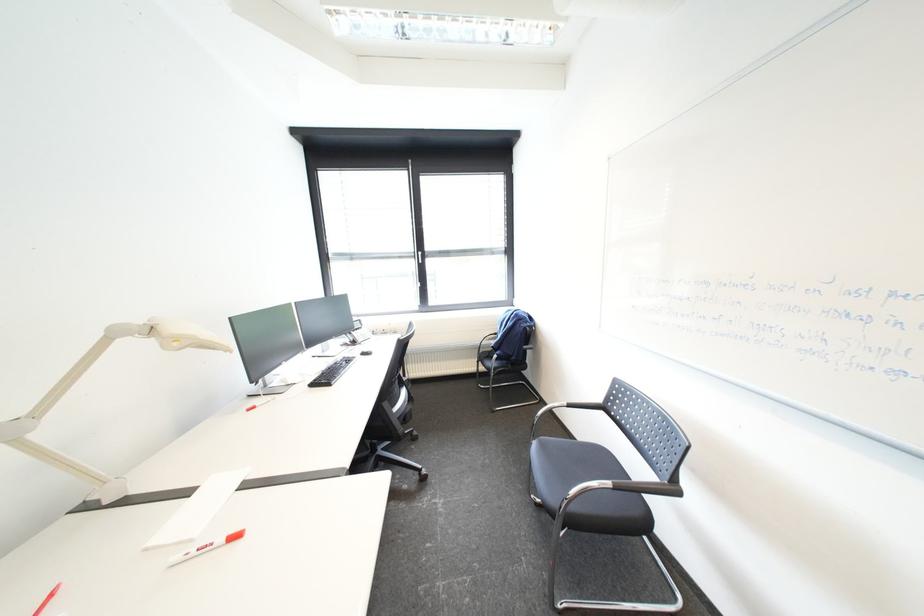
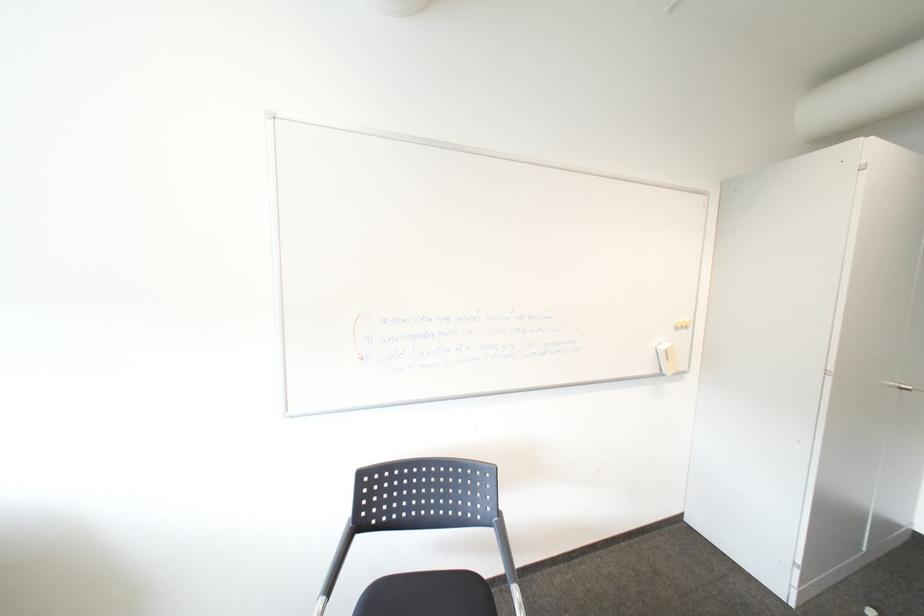
Question: Based on the continuous images, in which direction is the camera rotating? Reply with the corresponding letter.

Choices:
 (A) Left
 (B) Right
 (C) Up
 (D) Down

Answer: (B)